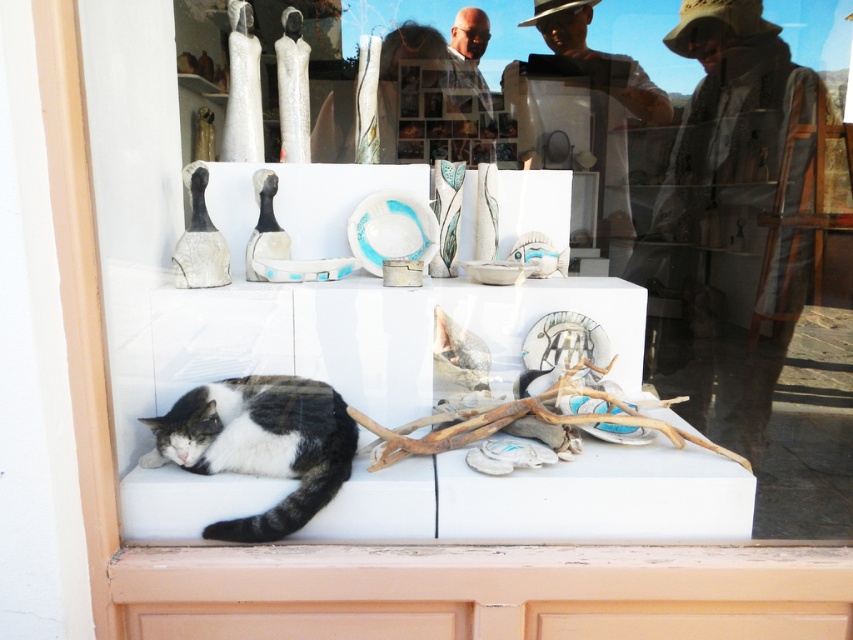
You are standing in front of the art shop display window and see two points marked on the glass. The first point is at coordinates point (244, 433) and the second point is at point (714, 448). Which point is closer to you?

Point (244, 433) is closer to the viewer than point (714, 448).